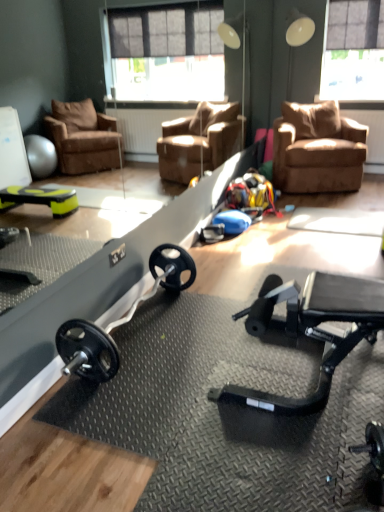
Question: From a real-world perspective, does black rubber barbell at center sit lower than translucent plastic window screen at upper right?

Choices:
 (A) no
 (B) yes

Answer: (B)

Question: Is black rubber barbell at center thinner than translucent plastic window screen at upper right?

Choices:
 (A) yes
 (B) no

Answer: (B)

Question: Could you tell me if black rubber barbell at center is turned towards translucent plastic window screen at upper right?

Choices:
 (A) no
 (B) yes

Answer: (A)

Question: From the image's perspective, would you say black rubber barbell at center is shown under translucent plastic window screen at upper right?

Choices:
 (A) yes
 (B) no

Answer: (A)

Question: From the image's perspective, does black rubber barbell at center appear higher than translucent plastic window screen at upper right?

Choices:
 (A) yes
 (B) no

Answer: (B)

Question: Does black rubber barbell at center appear on the right side of translucent plastic window screen at upper right?

Choices:
 (A) yes
 (B) no

Answer: (B)

Question: Is brown suede chair at upper right not close to black rubber barbell at center?

Choices:
 (A) no
 (B) yes

Answer: (B)

Question: From the image's perspective, is brown suede chair at upper right under black rubber barbell at center?

Choices:
 (A) no
 (B) yes

Answer: (A)

Question: Is brown suede chair at upper right at the right side of black rubber barbell at center?

Choices:
 (A) yes
 (B) no

Answer: (A)

Question: Considering the relative sizes of brown suede chair at upper right and black rubber barbell at center in the image provided, is brown suede chair at upper right smaller than black rubber barbell at center?

Choices:
 (A) yes
 (B) no

Answer: (B)

Question: Can you confirm if brown suede chair at upper right is thinner than black rubber barbell at center?

Choices:
 (A) yes
 (B) no

Answer: (B)

Question: Is brown suede chair at upper right turned away from black rubber barbell at center?

Choices:
 (A) no
 (B) yes

Answer: (A)

Question: From a real-world perspective, is translucent plastic window screen at upper right positioned under brown suede chair at upper right based on gravity?

Choices:
 (A) no
 (B) yes

Answer: (A)